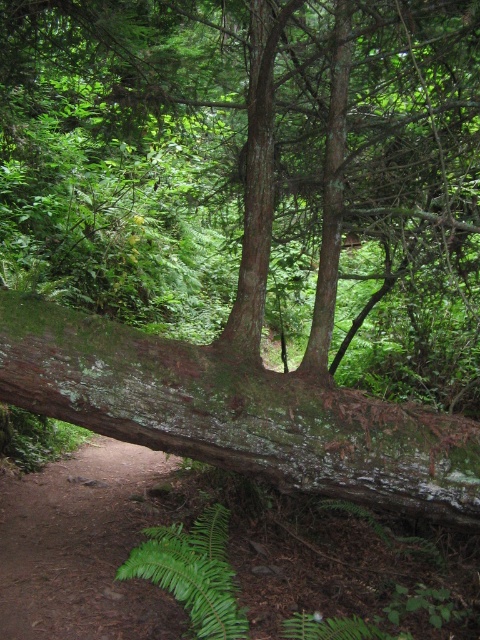
Based on the photo, you are a hiker navigating through the forest and come across a mossy log. According to the map, there is a point marked at coordinates [237,412]. Where is this point located in relation to the green mossy log at center?

The point marked at coordinates [237,412] is located at the center of the green mossy log at center.

You are a hiker trying to cross a narrow path in the forest. You see the green mossy log at center and the green leafy fern at lower center. Which object is wider and can provide a stable surface for walking?

The green mossy log at center might be wider than the green leafy fern at lower center, so it can provide a more stable surface for walking.

You are a hiker trying to cross the forest floor. You see the green mossy log at center and the green leafy fern at lower center. Which object is closer to you?

The green mossy log at center is positioned over the green leafy fern at lower center, so the green mossy log at center is closer to you.